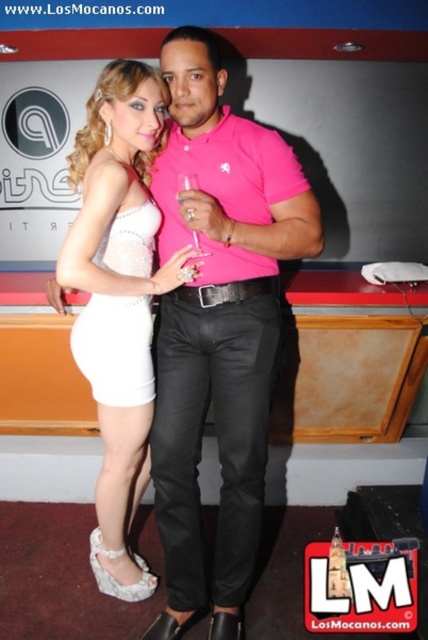
Is matte white dress at center closer to camera compared to white lace dress at left?

Yes, matte white dress at center is in front of white lace dress at left.

Between matte white dress at center and white lace dress at left, which one has more height?

Standing taller between the two is matte white dress at center.

Which is in front, point (241, 560) or point (148, 400)?

Point (241, 560)

Where is `matte white dress at center`? The height and width of the screenshot is (640, 428). matte white dress at center is located at coordinates (217, 324).

Is point (95, 209) positioned behind point (198, 186)?

Yes, point (95, 209) is behind point (198, 186).

Between white satin dress at center and transparent glass at center, which one is positioned higher?

transparent glass at center is above.

The height and width of the screenshot is (640, 428). What do you see at coordinates (118, 300) in the screenshot? I see `white satin dress at center` at bounding box center [118, 300].

Image resolution: width=428 pixels, height=640 pixels. Find the location of `white satin dress at center`. white satin dress at center is located at coordinates (118, 300).

Between white satin dress at center and white lace dress at left, which one is positioned lower?

Positioned lower is white satin dress at center.

Is white satin dress at center further to camera compared to white lace dress at left?

No, it is not.

Does point (149, 424) lie in front of point (98, 401)?

No.

Image resolution: width=428 pixels, height=640 pixels. In order to click on white satin dress at center in this screenshot , I will do `click(118, 300)`.